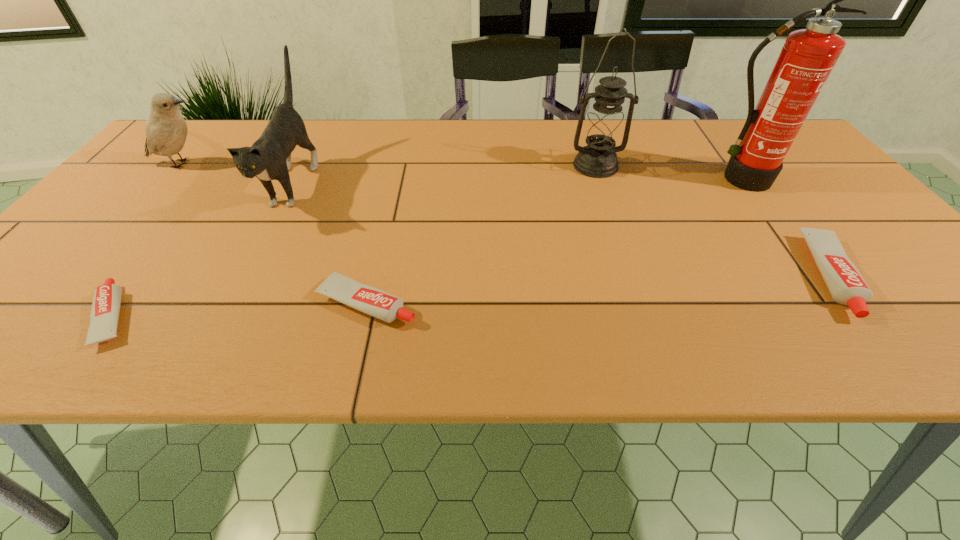
The height and width of the screenshot is (540, 960). Identify the location of free location that satisfies the following two spatial constraints: 1. at the beak of the bird; 2. on the back side of the second toothpaste from left to right. (63, 302).